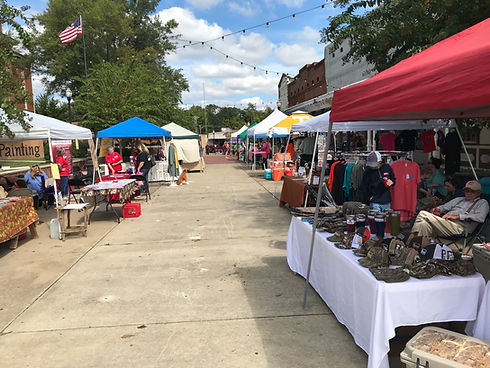
The image size is (490, 368). Find the location of `crate`. crate is located at coordinates (131, 212).